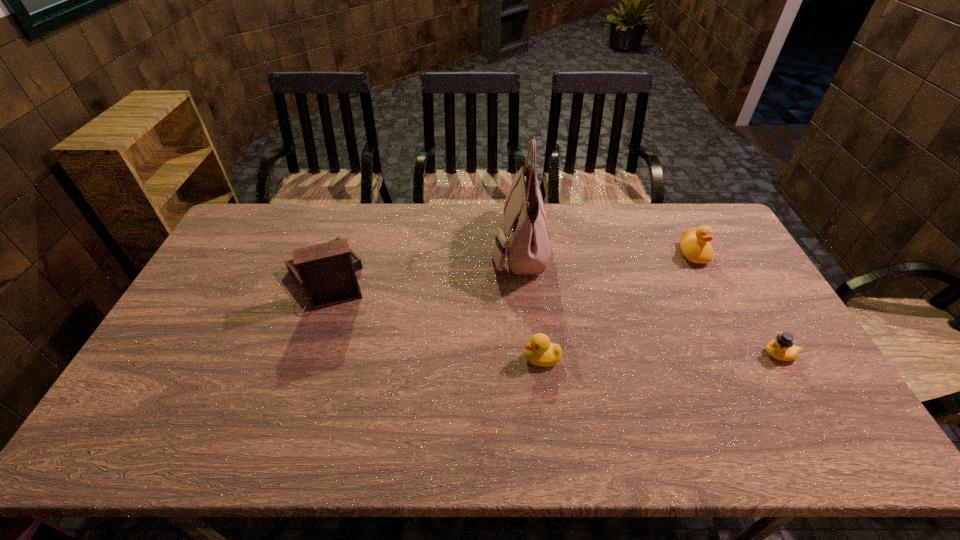
Image resolution: width=960 pixels, height=540 pixels. What are the coordinates of `vacant space that is in between the second shortest duck and the fourth shortest object` in the screenshot? It's located at (434, 319).

Locate an element on the screen. The width and height of the screenshot is (960, 540). empty space between the handbag and the phonograph record is located at coordinates (422, 262).

I want to click on free spot between the farthest duck and the leftmost object, so click(510, 266).

Locate an element on the screen. The height and width of the screenshot is (540, 960). free space between the shortest object and the second tallest duck is located at coordinates (660, 356).

Locate an element on the screen. The height and width of the screenshot is (540, 960). blank region between the second tallest object and the handbag is located at coordinates (422, 262).

Identify the location of empty space between the second tallest object and the second shortest duck. (434, 319).

Image resolution: width=960 pixels, height=540 pixels. I want to click on free space that is in between the tallest object and the leftmost duck, so click(530, 302).

Locate which object is the third closest to the rightmost object. Please provide its 2D coordinates. Your answer should be formatted as a tuple, i.e. [(x, y)], where the tuple contains the x and y coordinates of a point satisfying the conditions above.

[(526, 242)]

Identify which object is located as the third nearest to the leftmost object. Please provide its 2D coordinates. Your answer should be formatted as a tuple, i.e. [(x, y)], where the tuple contains the x and y coordinates of a point satisfying the conditions above.

[(694, 243)]

Locate an element on the screen. the closest duck to the leftmost object is located at coordinates (540, 352).